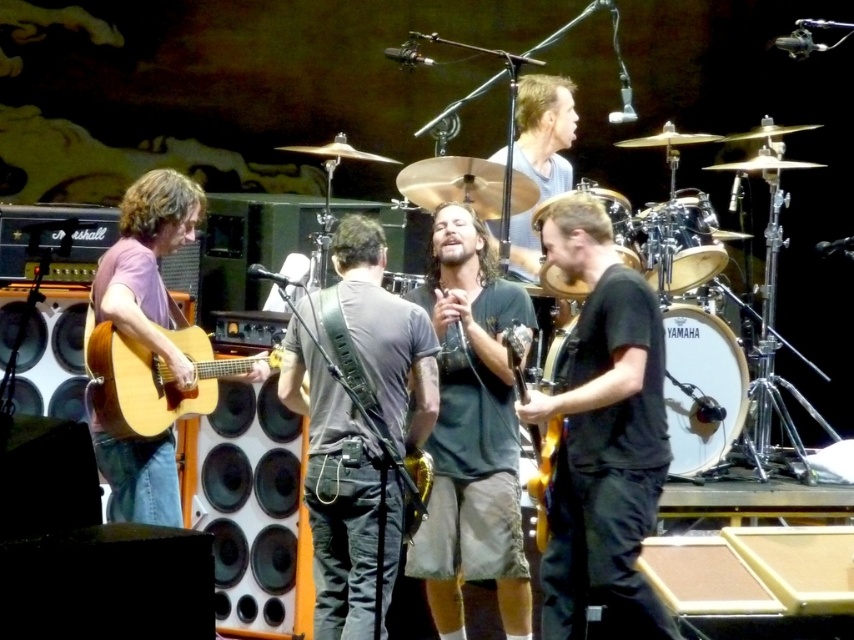
Question: Does dark gray t-shirt at center have a smaller size compared to wooden drum at center?

Choices:
 (A) yes
 (B) no

Answer: (B)

Question: Does matte brown guitar at left appear over white drumhead at center?

Choices:
 (A) no
 (B) yes

Answer: (B)

Question: Which of the following is the farthest from the observer?

Choices:
 (A) (720, 353)
 (B) (545, 204)
 (C) (452, 586)
 (D) (617, 586)

Answer: (A)

Question: Which point appears farthest from the camera in this image?

Choices:
 (A) (515, 348)
 (B) (322, 576)
 (C) (619, 228)

Answer: (C)

Question: Does black drum at center have a larger size compared to glossy wood guitar at center?

Choices:
 (A) no
 (B) yes

Answer: (A)

Question: Which point is farther to the camera?

Choices:
 (A) white drumhead at center
 (B) glossy wood guitar at center
 (C) smooth gray shirt at upper center

Answer: (C)